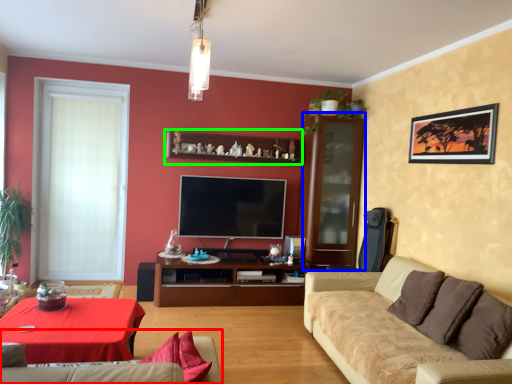
Question: Considering the real-world distances, which object is closest to studio couch (highlighted by a red box)? glass door (highlighted by a blue box) or shelf (highlighted by a green box).

Choices:
 (A) glass door
 (B) shelf

Answer: (B)